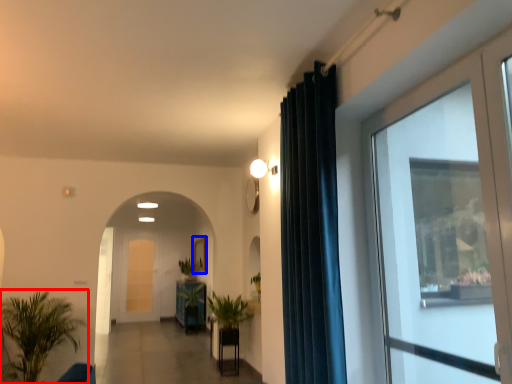
Question: Among these objects, which one is nearest to the camera, houseplant (highlighted by a red box) or picture frame (highlighted by a blue box)?

Choices:
 (A) houseplant
 (B) picture frame

Answer: (A)